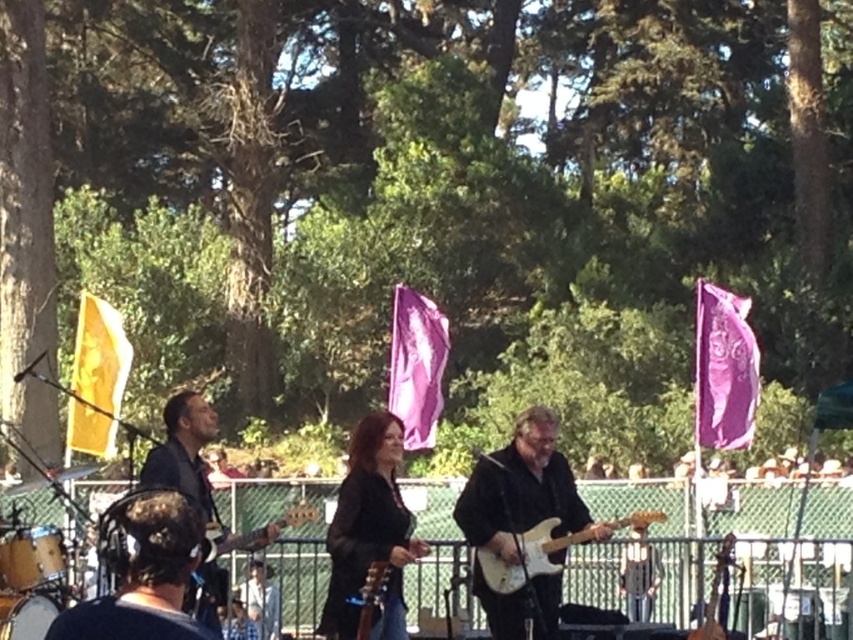
Question: Which point appears farthest from the camera in this image?

Choices:
 (A) (398, 630)
 (B) (305, 506)
 (C) (90, 435)
 (D) (160, 444)

Answer: (C)

Question: Does purple fabric flag at right have a lesser width compared to metallic gold guitar at center?

Choices:
 (A) yes
 (B) no

Answer: (B)

Question: Is black leather jacket at center behind purple fabric flag at right?

Choices:
 (A) yes
 (B) no

Answer: (B)

Question: Is black leather jacket at center further to the viewer compared to purple fabric flag at center?

Choices:
 (A) no
 (B) yes

Answer: (A)

Question: Estimate the real-world distances between objects in this image. Which object is farther from the metallic gold guitar at center?

Choices:
 (A) dark blue shirt at center
 (B) purple fabric flag at center

Answer: (B)

Question: Which of the following is the closest to the observer?

Choices:
 (A) purple fabric flag at right
 (B) wooden electric guitar at center
 (C) white glossy electric guitar at center
 (D) metallic gold guitar at center

Answer: (B)